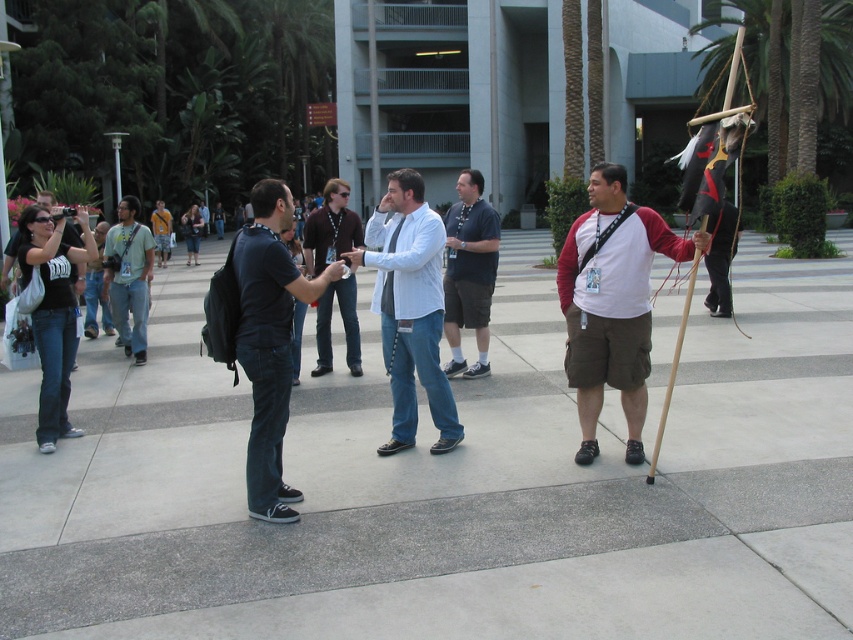
You are standing at the point with coordinates point (619, 328) and want to move towards the point with coordinates point (347, 188). Based on the scene, will you be moving towards the background or the foreground?

Since point (619, 328) is closer to the viewer than point (347, 188), moving from point (619, 328) towards point (347, 188) would mean moving towards the background.